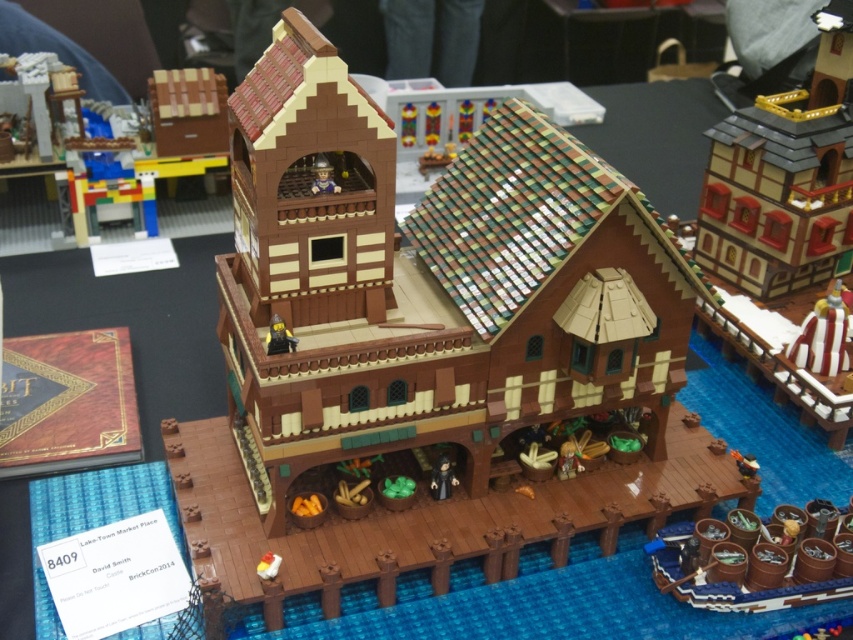
You are a visitor standing on the dock and want to take a photo of the brown wood building at center and the matte brown minifigure at center. Which object appears wider in the photo?

The brown wood building at center appears wider in the photo because its width surpasses that of the matte brown minifigure at center.

You are standing at the dock looking at the LEGO building. There are two points marked on the building. The first point is at coordinates point (341, 320) and the second point is at point (286, 328). Which point is closer to you?

Point (341, 320) is closer to you because it is further to the viewer than point (286, 328).